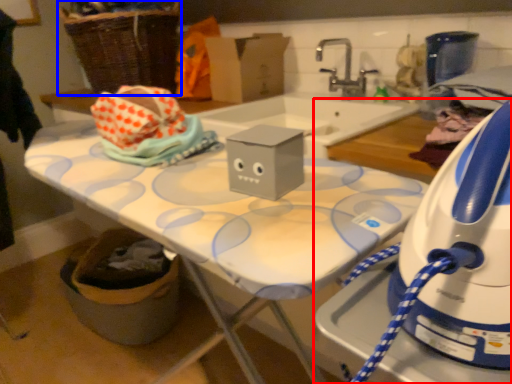
Question: Among these objects, which one is farthest to the camera, home appliance (highlighted by a red box) or basket (highlighted by a blue box)?

Choices:
 (A) home appliance
 (B) basket

Answer: (B)